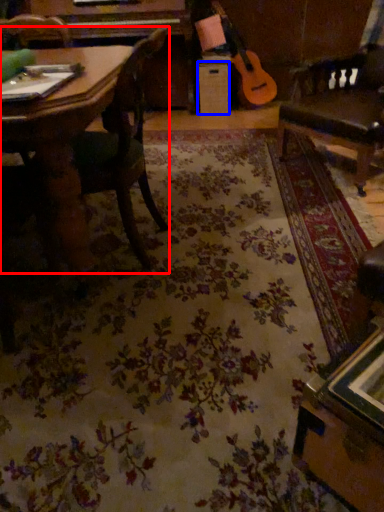
Question: Which object appears closest to the camera in this image, chair (highlighted by a red box) or drawer (highlighted by a blue box)?

Choices:
 (A) chair
 (B) drawer

Answer: (A)